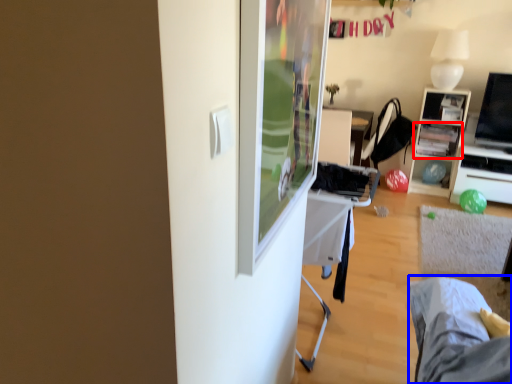
Question: Among these objects, which one is nearest to the camera, shelf (highlighted by a red box) or bed frame (highlighted by a blue box)?

Choices:
 (A) shelf
 (B) bed frame

Answer: (B)